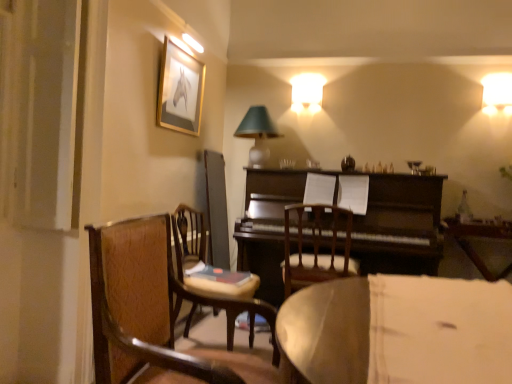
Question: Is wooden chair at center, which is the second chair from back to front, positioned beyond the bounds of matte glass table lamp at upper center?

Choices:
 (A) no
 (B) yes

Answer: (B)

Question: Is matte glass table lamp at upper center located within wooden chair at center, the 2th chair viewed from the front?

Choices:
 (A) no
 (B) yes

Answer: (A)

Question: Can you confirm if wooden chair at center, which is the second chair from back to front, is thinner than matte glass table lamp at upper center?

Choices:
 (A) yes
 (B) no

Answer: (B)

Question: Is wooden chair at center, the 2th chair viewed from the front, oriented away from matte glass table lamp at upper center?

Choices:
 (A) yes
 (B) no

Answer: (B)

Question: Does wooden chair at center, which is the second chair from back to front, lie behind matte glass table lamp at upper center?

Choices:
 (A) yes
 (B) no

Answer: (B)

Question: Considering the positions of wooden chair at center, which is the first chair from back to front, and wooden table at center in the image, is wooden chair at center, which is the first chair from back to front, wider or thinner than wooden table at center?

Choices:
 (A) thin
 (B) wide

Answer: (B)

Question: Would you say wooden chair at center, marked as the 3th chair in a front-to-back arrangement, is to the left or to the right of wooden table at center in the picture?

Choices:
 (A) right
 (B) left

Answer: (B)

Question: From the image's perspective, is wooden chair at center, which is the first chair from back to front, positioned above or below wooden table at center?

Choices:
 (A) below
 (B) above

Answer: (A)

Question: Is wooden chair at center, which is the first chair from back to front, spatially inside wooden table at center, or outside of it?

Choices:
 (A) inside
 (B) outside

Answer: (B)

Question: Does point (178, 64) appear closer or farther from the camera than point (274, 253)?

Choices:
 (A) closer
 (B) farther

Answer: (A)

Question: Is gold-framed picture at upper left situated inside dark brown polished wood piano at center or outside?

Choices:
 (A) outside
 (B) inside

Answer: (A)

Question: From the image's perspective, is gold-framed picture at upper left positioned above or below dark brown polished wood piano at center?

Choices:
 (A) above
 (B) below

Answer: (A)

Question: Considering their positions, is gold-framed picture at upper left located in front of or behind dark brown polished wood piano at center?

Choices:
 (A) behind
 (B) front

Answer: (B)

Question: Considering the positions of matte glass table lamp at upper center and wooden chair at center, which is the second chair from back to front, in the image, is matte glass table lamp at upper center taller or shorter than wooden chair at center, which is the second chair from back to front,?

Choices:
 (A) tall
 (B) short

Answer: (B)

Question: Relative to wooden chair at center, which is the second chair from back to front, is matte glass table lamp at upper center in front or behind?

Choices:
 (A) front
 (B) behind

Answer: (B)